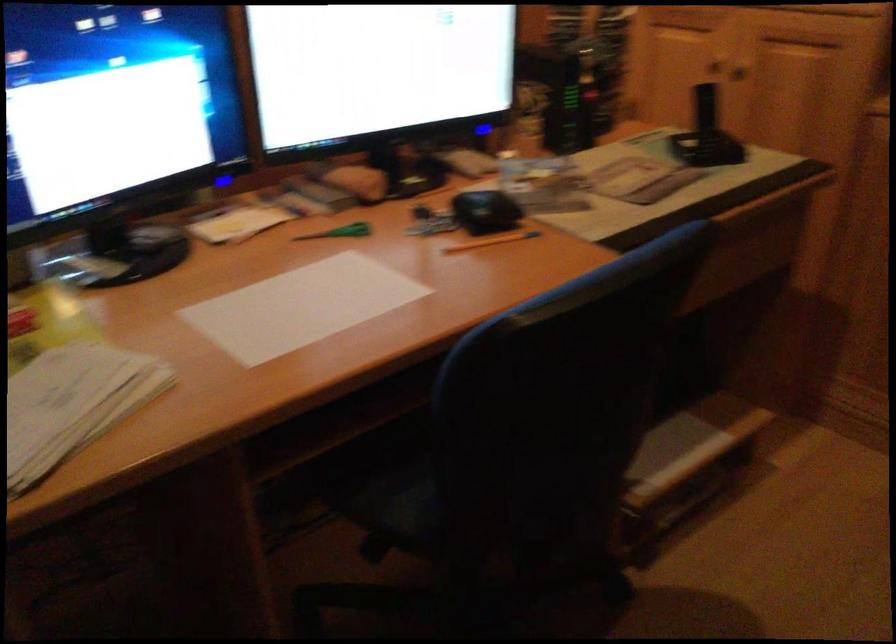
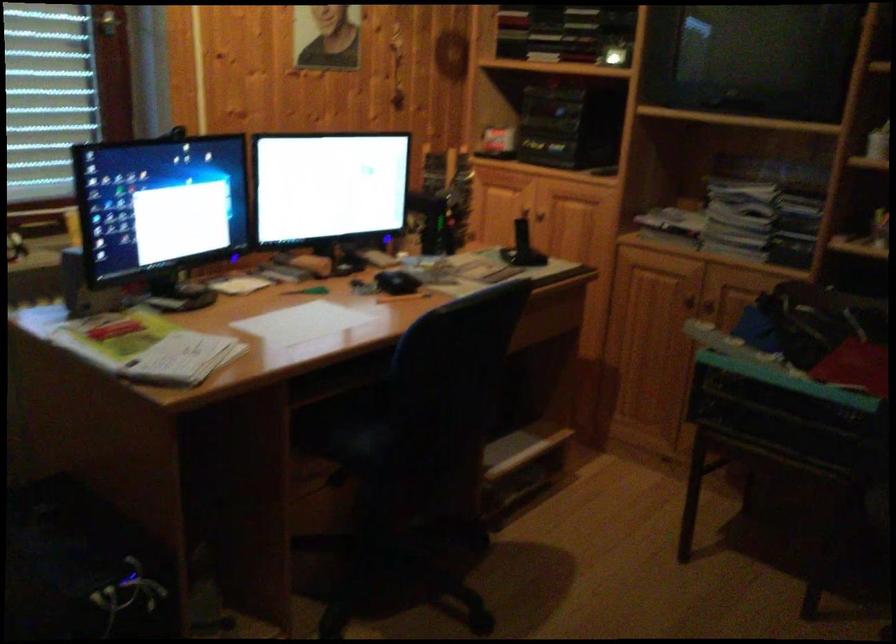
Question: What movement of the cameraman would produce the second image?

Choices:
 (A) Left
 (B) Right
 (C) Forward
 (D) Backward

Answer: (D)